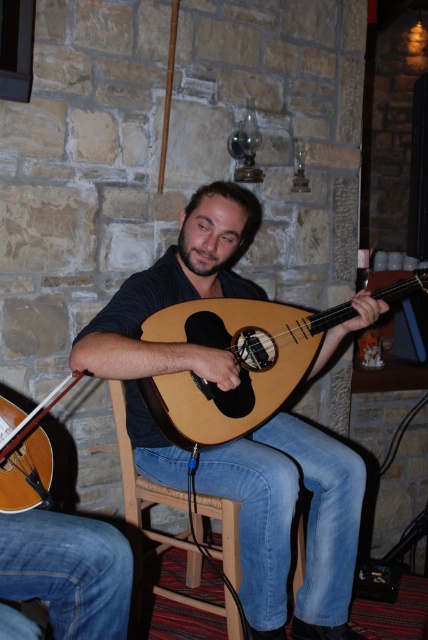
You are a photographer standing at the entrance of the room. You want to take a photo of the matte brown mandolin at center. Based on its position coordinates, where should you aim your camera to capture it in the frame?

The matte brown mandolin at center is located at coordinates point (291, 524), so you should aim your camera towards the lower right portion of the frame to capture it.

You are a music teacher who wants to place both the natural wood mandolin at center and the matte brown violin at lower left on a shelf. The shelf has a height limit of 10 cm. Can both instruments fit vertically on the shelf without exceeding the height limit?

The natural wood mandolin at center has a greater height compared to matte brown violin at lower left. However, since the shelf has a height limit of 10 cm, we need to know the exact heights of both instruments to determine if they can fit. Unfortunately, the provided information does not specify their actual heights, only their relative sizes. Therefore, it is impossible to confirm if both will fit within the 10 cm limit based on the given data.